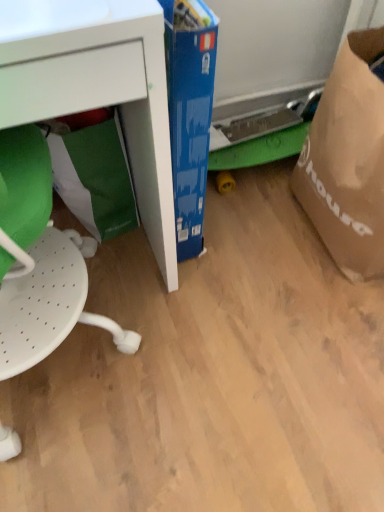
Question: Is white matte desk at lower left inside or outside of brown paper grocery bag at right, which is the 2th grocery bag in left-to-right order?

Choices:
 (A) inside
 (B) outside

Answer: (B)

Question: From a real-world perspective, is white matte desk at lower left physically located above or below brown paper grocery bag at right, which is counted as the first grocery bag, starting from the right?

Choices:
 (A) above
 (B) below

Answer: (A)

Question: Which object is positioned farthest from the blue cardboard box at center?

Choices:
 (A) green paper bag at lower left, the second grocery bag from the right
 (B) brown paper grocery bag at right, which is the 2th grocery bag in left-to-right order
 (C) white perforated swivel chair at left
 (D) white matte desk at lower left

Answer: (C)

Question: Based on their relative distances, which object is nearer to the white perforated swivel chair at left?

Choices:
 (A) brown paper grocery bag at right, which is counted as the first grocery bag, starting from the right
 (B) white matte desk at lower left
 (C) blue cardboard box at center
 (D) green paper bag at lower left, which ranks as the 1th grocery bag in left-to-right order

Answer: (D)